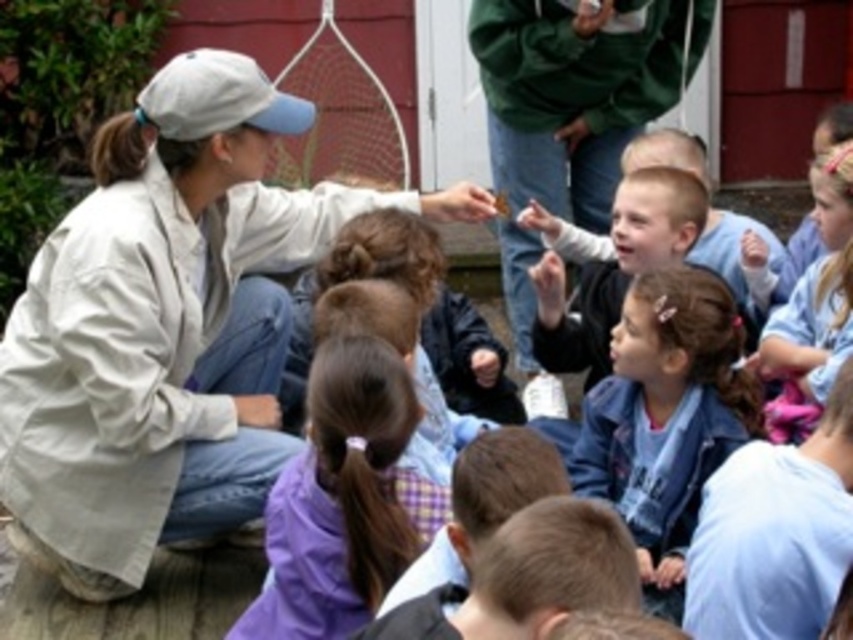
Which is above, light beige jacket at upper left or purple fabric at center?

purple fabric at center is higher up.

Is point (196, 429) positioned behind point (816, 536)?

Yes, it is behind point (816, 536).

Find the location of a particular element. light beige jacket at upper left is located at coordinates (166, 326).

Who is positioned more to the right, green matte jacket at upper center or purple plaid shirt at center?

green matte jacket at upper center is more to the right.

Does point (553, 168) come in front of point (376, 470)?

No, it is not.

Find the location of `green matte jacket at upper center`. green matte jacket at upper center is located at coordinates (572, 93).

Which of these two, light beige jacket at upper left or light blue denim jacket at upper right, stands taller?

light blue denim jacket at upper right is taller.

Is point (178, 188) closer to viewer compared to point (851, 273)?

No, it is not.

Which is behind, point (305, 113) or point (842, 282)?

The point (305, 113) is behind.

You are a GUI agent. You are given a task and a screenshot of the screen. Output one action in this format:
    pyautogui.click(x=<x>, y=<y>)
    Task: Click on the light beige jacket at upper left
    This screenshot has height=640, width=853.
    Given the screenshot: What is the action you would take?
    pyautogui.click(x=166, y=326)